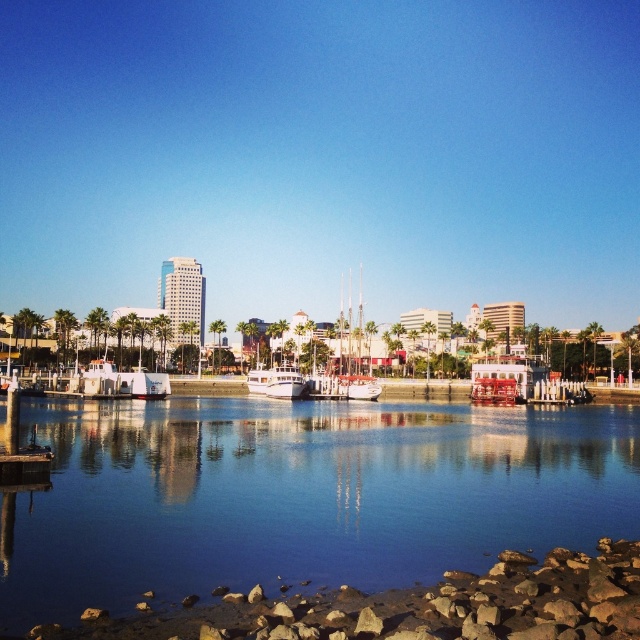
Does white glossy sailboat at center have a greater width compared to white glossy boat at center?

Yes, white glossy sailboat at center is wider than white glossy boat at center.

Who is positioned more to the right, white glossy sailboat at center or white glossy boat at center?

white glossy sailboat at center is more to the right.

What do you see at coordinates (358, 365) in the screenshot? I see `white glossy sailboat at center` at bounding box center [358, 365].

The width and height of the screenshot is (640, 640). Find the location of `white glossy sailboat at center`. white glossy sailboat at center is located at coordinates (358, 365).

Does clear water at center have a greater height compared to white glossy boat at center?

No, clear water at center is not taller than white glossy boat at center.

At what (x,y) coordinates should I click in order to perform the action: click on clear water at center. Please return your answer as a coordinate pair (x, y). This screenshot has width=640, height=640. Looking at the image, I should click on (301, 493).

Locate an element on the screen. This screenshot has height=640, width=640. clear water at center is located at coordinates (301, 493).

Can you confirm if clear water at center is positioned above white glossy sailboat at center?

No.

Is point (529, 444) less distant than point (356, 364)?

Yes, point (529, 444) is in front of point (356, 364).

Is point (266, 445) positioned after point (371, 384)?

That is False.

Locate an element on the screen. clear water at center is located at coordinates (301, 493).